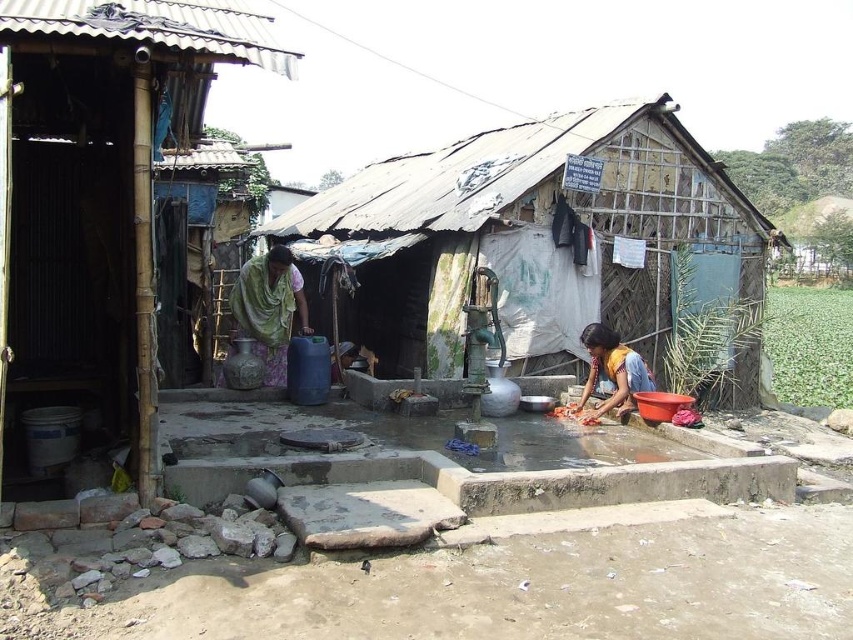
You are standing on the concrete platform near the water pump and see the green fabric shawl at center and the yellow fabric dress at lower right. Which object is taller from your viewpoint?

The green fabric shawl at center is much taller than the yellow fabric dress at lower right.

You are a traveler who needs to determine the relative sizes of objects in the scene. Based on the image, which object is wider between the rusty corrugated metal hut at center and the yellow fabric dress at lower right?

The rusty corrugated metal hut at center is wider than the yellow fabric dress at lower right according to the description.

You are a traveler carrying a backpack and need to place your items between the green fabric shawl at center and the yellow fabric dress at lower right. Can you fit your backpack there if it requires at least 3 meters of space?

The distance between the green fabric shawl at center and the yellow fabric dress at lower right is 3.25 meters, which is more than the required 3 meters. Yes, you can fit your backpack there.